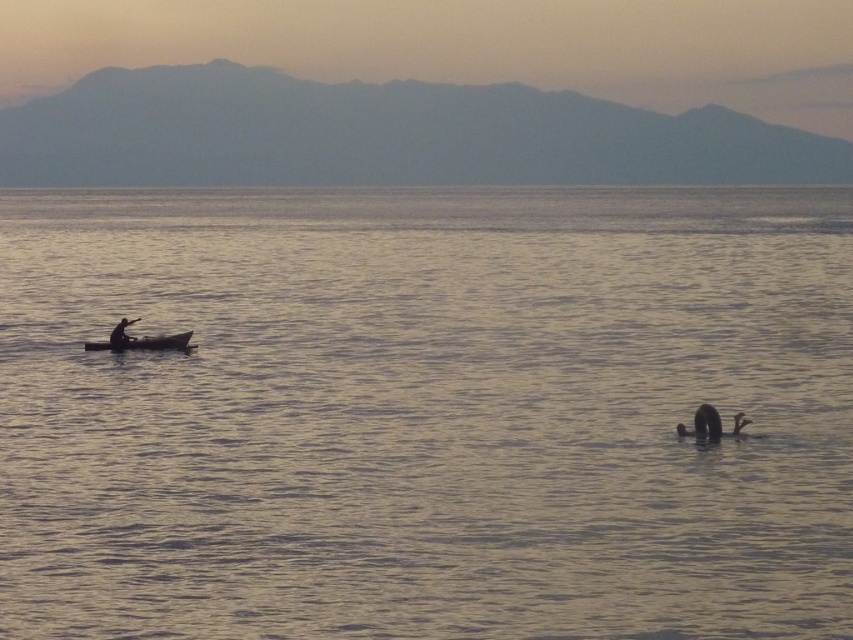
Question: Which object is positioned closest to the wooden canoe at left?

Choices:
 (A) smooth water at center
 (B) smooth skin person at left

Answer: (B)

Question: Where is smooth water at center located in relation to smooth skin person at left in the image?

Choices:
 (A) below
 (B) above

Answer: (B)

Question: Which object is the farthest from the smooth skin person at left?

Choices:
 (A) wooden canoe at left
 (B) smooth water at center

Answer: (B)

Question: Is smooth water at center bigger than wooden canoe at left?

Choices:
 (A) no
 (B) yes

Answer: (B)

Question: Among these objects, which one is nearest to the camera?

Choices:
 (A) wooden canoe at left
 (B) smooth skin person at left
 (C) smooth water at center

Answer: (C)

Question: Is smooth water at center smaller than smooth skin person at left?

Choices:
 (A) yes
 (B) no

Answer: (B)